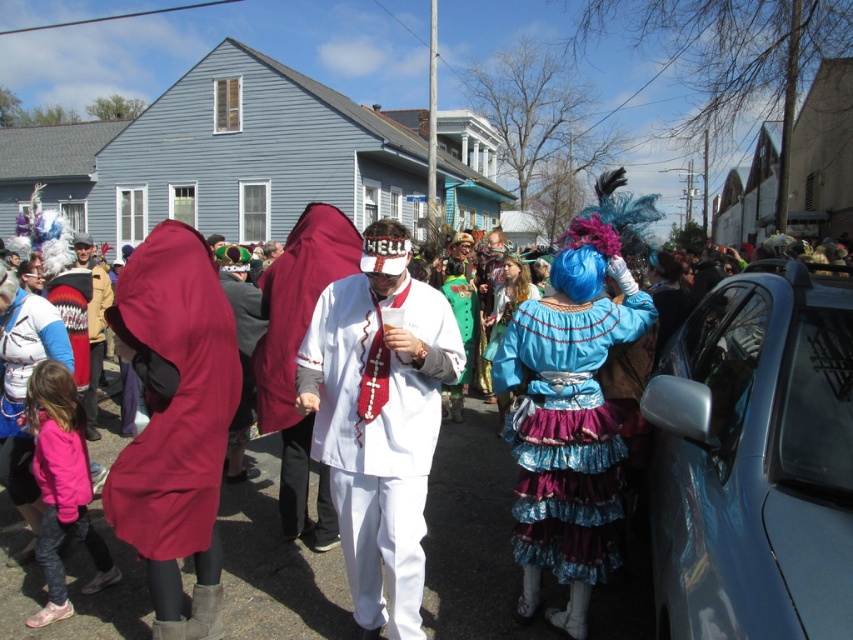
Consider the image. Which is above, velvet maroon cape at left or shiny blue fabric dress at center?

velvet maroon cape at left is higher up.

How much distance is there between velvet maroon cape at left and shiny blue fabric dress at center?

velvet maroon cape at left is 1.87 meters from shiny blue fabric dress at center.

Who is more distant from viewer, (146, 284) or (523, 438)?

Positioned behind is point (523, 438).

Locate an element on the screen. velvet maroon cape at left is located at coordinates pos(173,394).

Can you confirm if blue metallic car at right is positioned above shiny blue fabric dress at center?

Yes, blue metallic car at right is above shiny blue fabric dress at center.

Between blue metallic car at right and shiny blue fabric dress at center, which one is positioned higher?

blue metallic car at right is higher up.

Who is more distant from viewer, (764, 412) or (585, 308)?

Point (585, 308)

What are the coordinates of `blue metallic car at right` in the screenshot? It's located at (755, 460).

The height and width of the screenshot is (640, 853). Find the location of `white matte suit at center`. white matte suit at center is located at coordinates (379, 420).

Can you confirm if white matte suit at center is wider than shiny blue fabric dress at center?

Incorrect, white matte suit at center's width does not surpass shiny blue fabric dress at center's.

This screenshot has width=853, height=640. In order to click on white matte suit at center in this screenshot , I will do `click(379, 420)`.